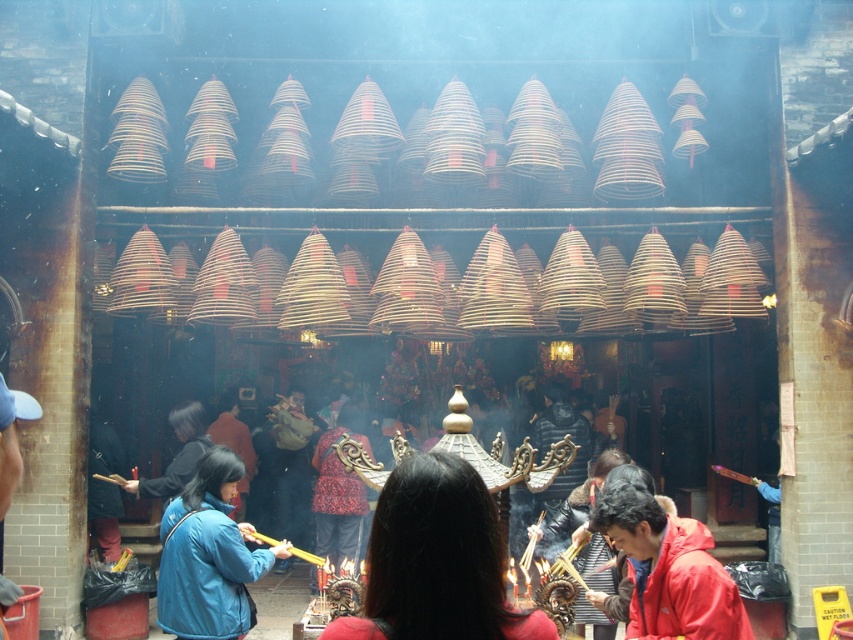
From the picture: Does red matte jacket at center appear on the right side of blue fabric robe at lower left?

Correct, you'll find red matte jacket at center to the right of blue fabric robe at lower left.

Does point (454, 477) come closer to viewer compared to point (187, 516)?

Yes, it is in front of point (187, 516).

Where is `red matte jacket at center`? This screenshot has width=853, height=640. red matte jacket at center is located at coordinates (437, 561).

In the scene shown: Who is positioned more to the right, red matte jacket at center or red patterned fabric at center?

red matte jacket at center

Is red matte jacket at center shorter than red patterned fabric at center?

Indeed, red matte jacket at center has a lesser height compared to red patterned fabric at center.

Is point (358, 632) closer to viewer compared to point (339, 532)?

Yes, it is.

Image resolution: width=853 pixels, height=640 pixels. In order to click on red matte jacket at center in this screenshot , I will do `click(437, 561)`.

Can you confirm if red matte jacket at center is wider than red matte jacket at lower right?

Yes.

Is red matte jacket at center taller than red matte jacket at lower right?

In fact, red matte jacket at center may be shorter than red matte jacket at lower right.

Is point (465, 493) closer to viewer compared to point (636, 609)?

Yes, it is in front of point (636, 609).

Identify the location of red matte jacket at center. The width and height of the screenshot is (853, 640). (437, 561).